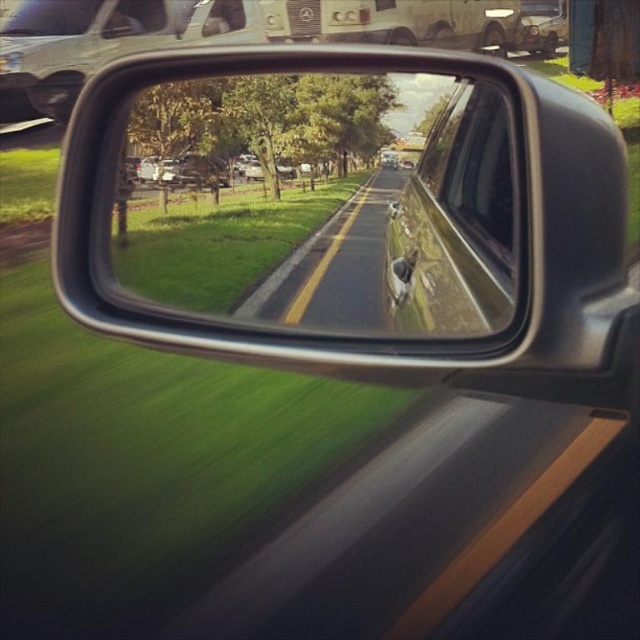
Question: Which object is closer to the camera taking this photo?

Choices:
 (A) glossy reflective road at center
 (B) transparent glass car window at center

Answer: (A)

Question: Is glossy metallic mirror at center behind glossy reflective road at center?

Choices:
 (A) no
 (B) yes

Answer: (A)

Question: Which object appears farthest from the camera in this image?

Choices:
 (A) glossy metallic mirror at center
 (B) transparent glass car window at center

Answer: (B)

Question: Among these points, which one is farthest from the camera?

Choices:
 (A) (497, 104)
 (B) (147, 68)
 (C) (397, 83)

Answer: (B)

Question: Does glossy metallic mirror at center appear on the left side of glossy reflective road at center?

Choices:
 (A) yes
 (B) no

Answer: (B)

Question: Does glossy metallic mirror at center have a smaller size compared to glossy reflective road at center?

Choices:
 (A) no
 (B) yes

Answer: (A)